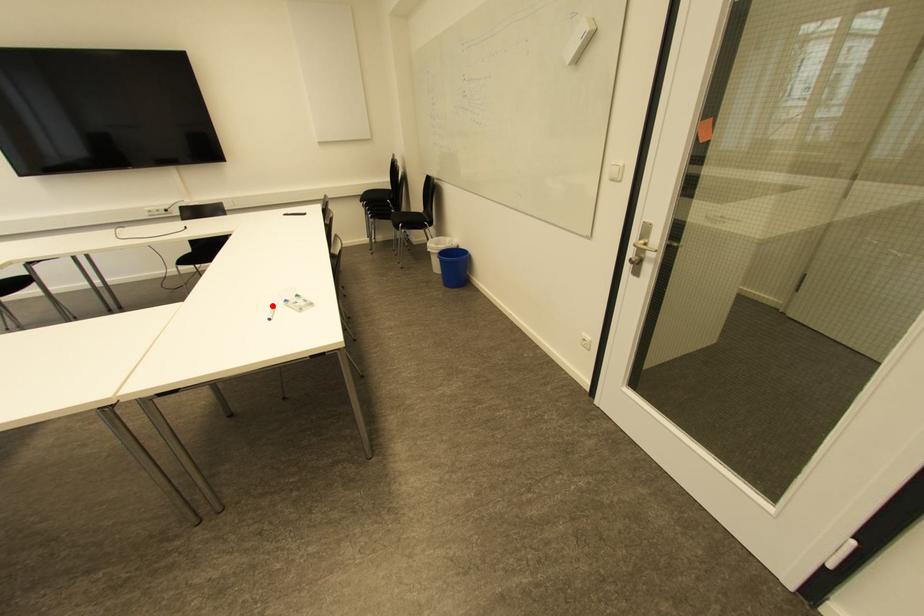
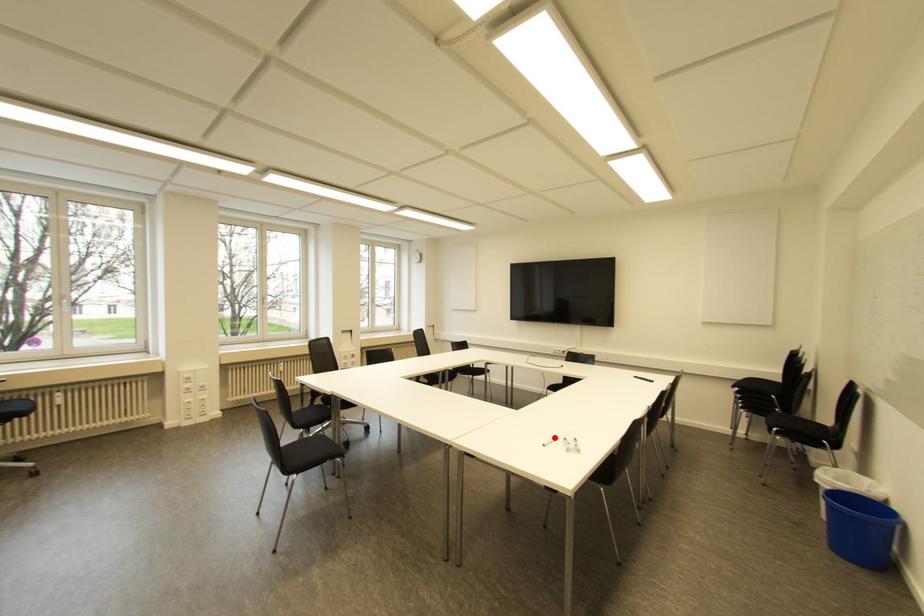
I am providing you with two images of the same scene from different viewpoints. A red point is marked on the first image and another point is marked on the second image. Does the point marked in image1 correspond to the same location as the one in image2?

Yes